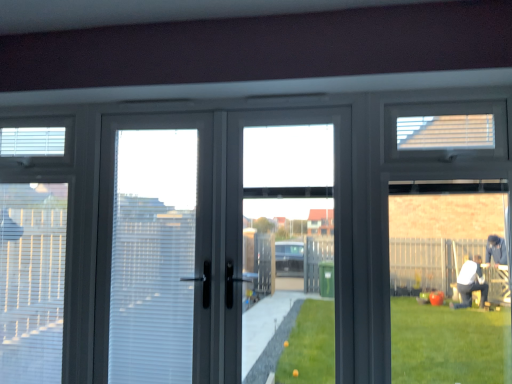
Question: Is white plastic blind at upper left, which is counted as the third blind, starting from the right, inside the boundaries of matte gray screen door at center, or outside?

Choices:
 (A) inside
 (B) outside

Answer: (B)

Question: Is white plastic blind at upper left, positioned as the 1th blind in back-to-front order, wider or thinner than matte gray screen door at center?

Choices:
 (A) thin
 (B) wide

Answer: (A)

Question: Estimate the real-world distances between objects in this image. Which object is farther from the white textured blind at left, arranged as the 1th blind when ordered from the bottom?

Choices:
 (A) matte gray screen door at center
 (B) transparent glass door at center
 (C) white plastic blind at upper left, the 3th blind in the front-to-back sequence
 (D) matte glass window at right
 (E) white matte blind at upper right, positioned as the 1th blind in front-to-back order

Answer: (D)

Question: Estimate the real-world distances between objects in this image. Which object is closer to the transparent glass door at center?

Choices:
 (A) white matte blind at upper right, positioned as the third blind in left-to-right order
 (B) matte glass window at right
 (C) white textured blind at left, the third blind when ordered from top to bottom
 (D) white plastic blind at upper left, placed as the 2th blind when sorted from bottom to top
 (E) matte gray screen door at center

Answer: (E)